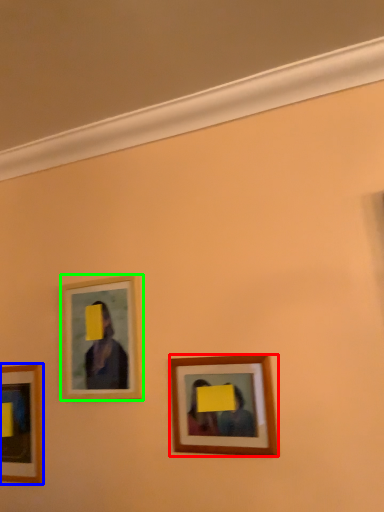
Question: Based on their relative distances, which object is nearer to picture frame (highlighted by a red box)? Choose from picture frame (highlighted by a blue box) and picture frame (highlighted by a green box).

Choices:
 (A) picture frame
 (B) picture frame

Answer: (B)